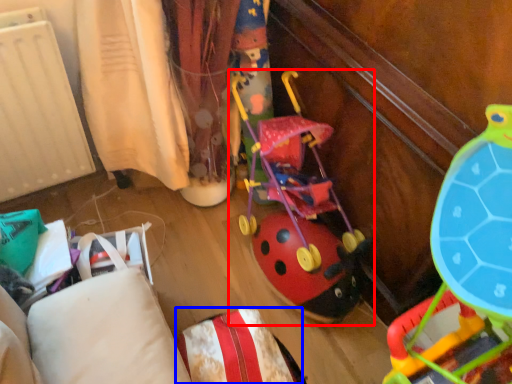
Question: Among these objects, which one is farthest to the camera, toy (highlighted by a red box) or pillow (highlighted by a blue box)?

Choices:
 (A) toy
 (B) pillow

Answer: (A)